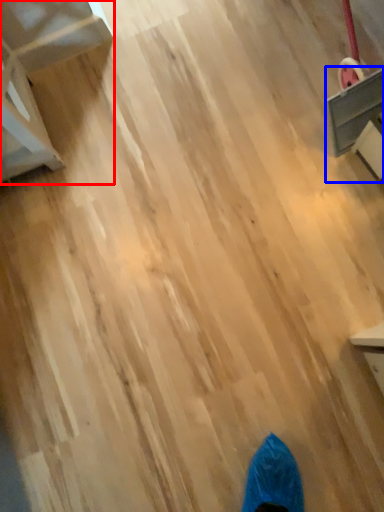
Question: Among these objects, which one is nearest to the camera, furniture (highlighted by a red box) or furniture (highlighted by a blue box)?

Choices:
 (A) furniture
 (B) furniture

Answer: (A)